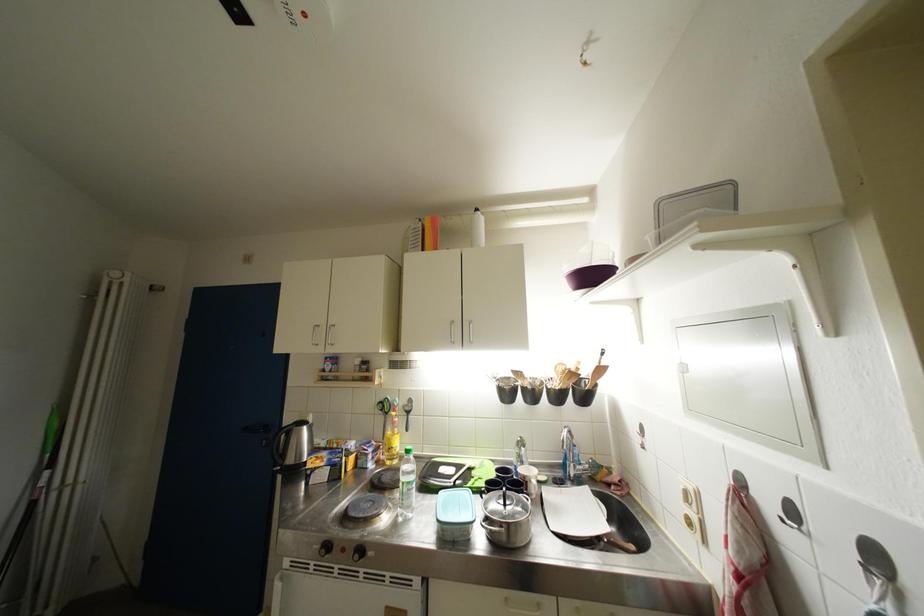
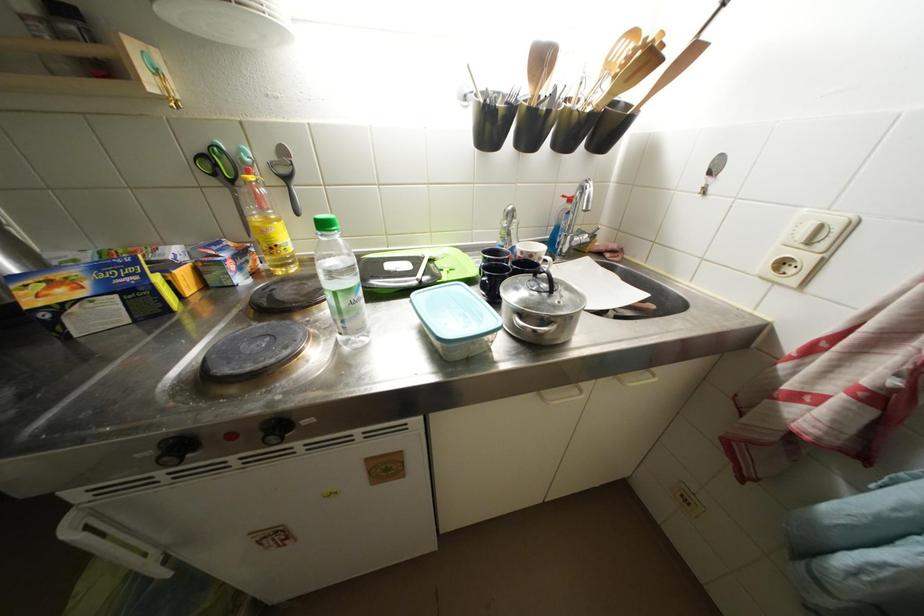
Based on the continuous images, in which direction is the camera rotating?

The camera rotated toward right-down.